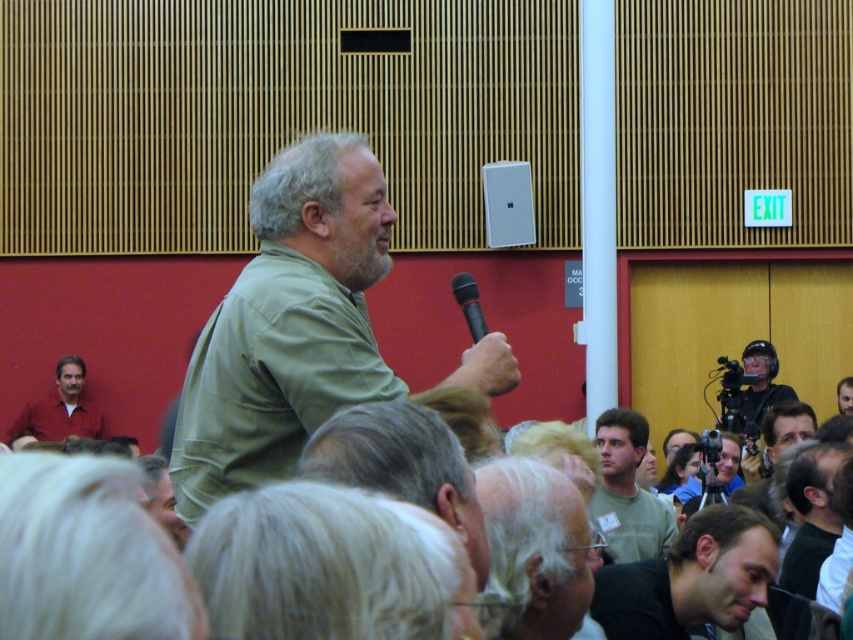
Is point (498, 464) behind point (357, 449)?

Yes.

Can you confirm if white hair at center is positioned below gray hair at center?

Yes.

Is point (567, 627) positioned after point (302, 470)?

Yes, it is.

Identify the location of white hair at center. (532, 550).

Does white hair at center lie behind black plastic microphone at upper center?

No.

Does white hair at center have a greater height compared to black plastic microphone at upper center?

Indeed, white hair at center has a greater height compared to black plastic microphone at upper center.

This screenshot has width=853, height=640. What do you see at coordinates (532, 550) in the screenshot?
I see `white hair at center` at bounding box center [532, 550].

Locate an element on the screen. white hair at center is located at coordinates (532, 550).

Is green matte shirt at lower center below black plastic microphone at upper center?

Yes.

Locate an element on the screen. The height and width of the screenshot is (640, 853). green matte shirt at lower center is located at coordinates (627, 492).

Find the location of a particular element. green matte shirt at lower center is located at coordinates (627, 492).